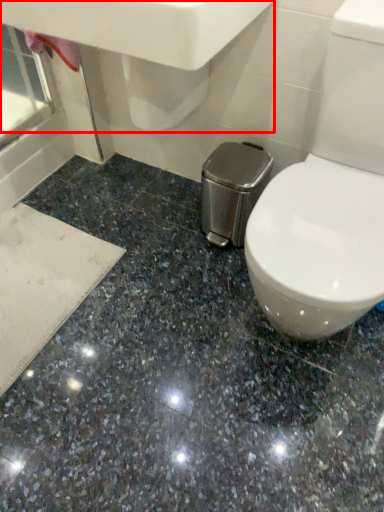
Question: From the image's perspective, what is the correct spatial relationship of sink (annotated by the red box) in relation to granite?

Choices:
 (A) above
 (B) below

Answer: (A)